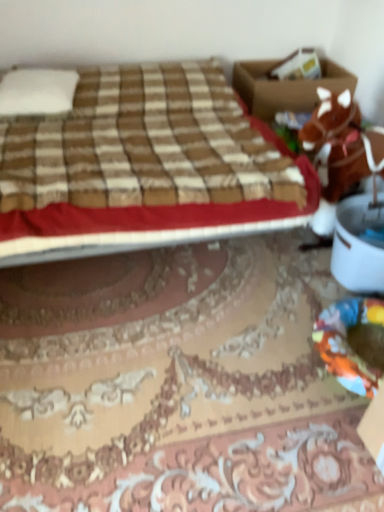
Locate an element on the screen. free point above white soft pillow at upper left (from a real-world perspective) is located at coordinates (32, 91).